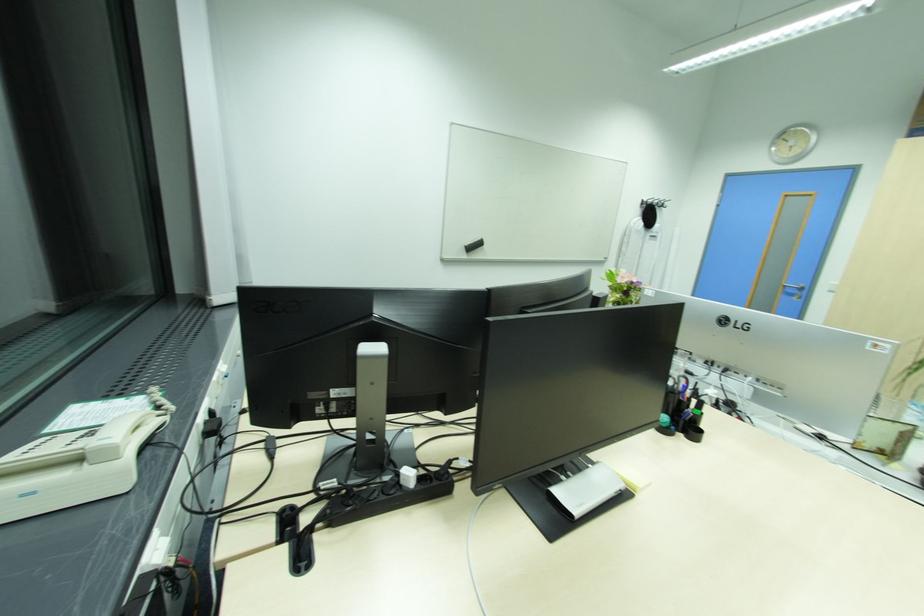
This screenshot has height=616, width=924. I want to click on small flower vase, so [622, 286].